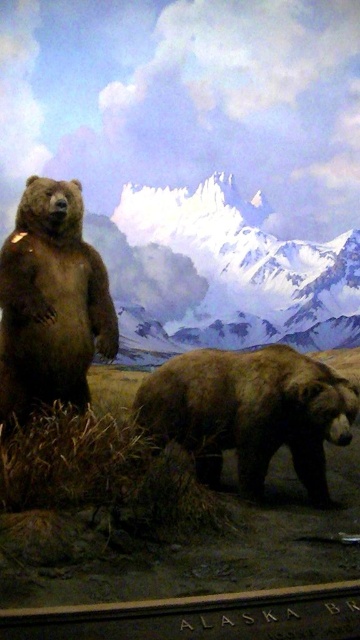
You are a photographer setting up a tripod to capture the brown fuzzy bear at center. The tripod requires a flat area at least 0.5 meters wide. The point marked at coordinates point (249, 412) indicates the bear. Is there enough space around the bear to set up the tripod?

The point (249, 412) marks the brown fuzzy bear at center, but there is no information provided about the space around it. Please check the scene description for details about the terrain or obstacles near the bear.

From the picture: You are an animal caretaker observing the two bears in the diorama. You notice that the sandy brown fur at left and the shiny brown bear at left are part of the same bear. Which part of the bear is higher up?

The sandy brown fur at left is located above the shiny brown bear at left, so the sandy brown fur at left is the higher part of the bear.